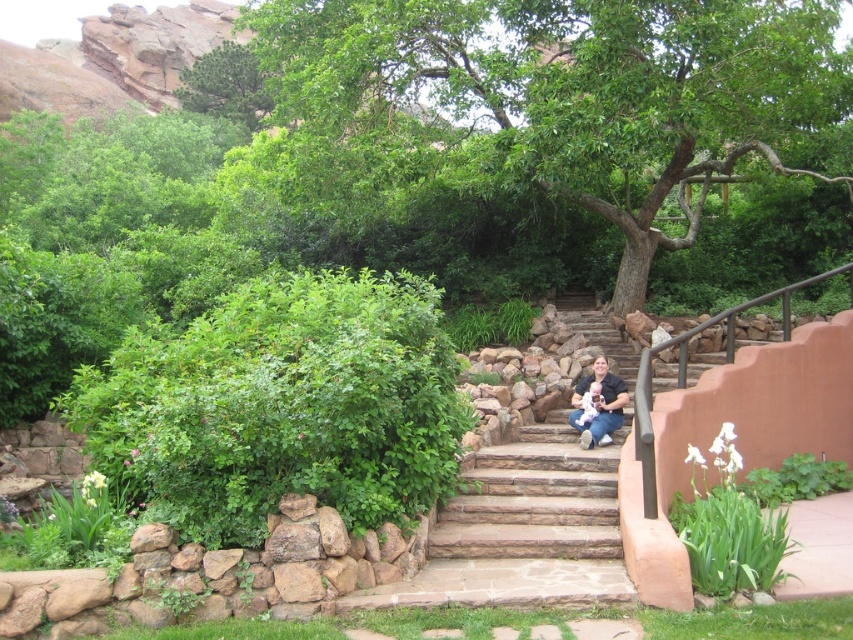
You are a photographer wanting to capture a photo of the green leafy tree at center and the matte black shirt at center. Since you want both subjects to be in focus, which one should you focus on first to ensure depth of field?

The green leafy tree at center is taller than the matte black shirt at center, so you should focus on the green leafy tree at center first to ensure both are in focus.

You are a photographer standing at the bottom of the stone steps. You want to take a photo of the green leafy tree at upper center and the matte black shirt at center. Which object should you focus on first if you want to capture both in the same frame without moving the camera?

The green leafy tree at upper center is above the matte black shirt at center, so you should focus on the matte black shirt at center first to ensure both are in the frame.